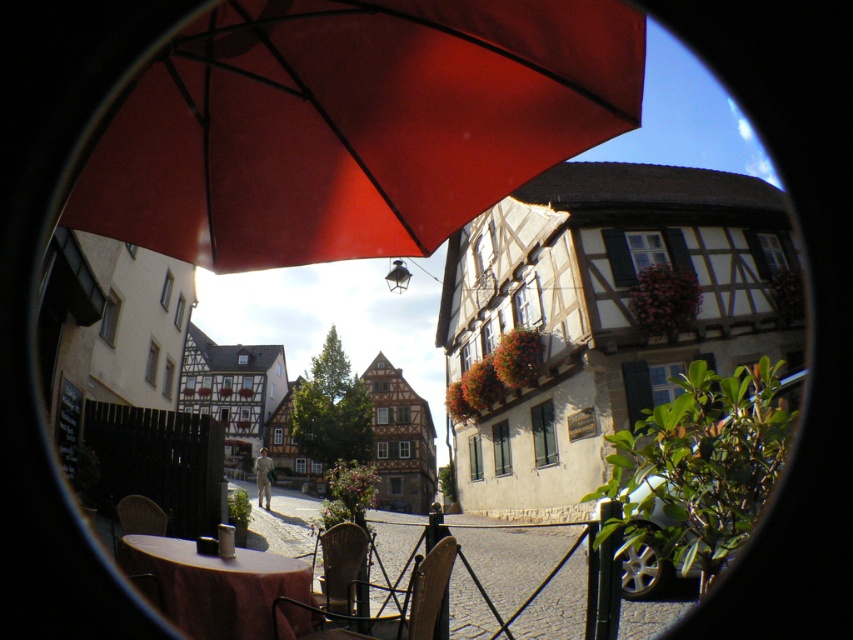
Question: In this image, where is smooth stone alley at center located relative to brown fabric table at lower left?

Choices:
 (A) below
 (B) above

Answer: (A)

Question: Which point is farther to the camera?

Choices:
 (A) (456, 548)
 (B) (544, 19)
 (C) (556, 620)
 (D) (335, 582)

Answer: (C)

Question: Does wooden chair at lower center have a lesser width compared to metallic brown chair at center?

Choices:
 (A) yes
 (B) no

Answer: (B)

Question: Which of the following is the farthest from the observer?

Choices:
 (A) metallic brown chair at center
 (B) smooth stone alley at center
 (C) wooden chair at lower center

Answer: (B)

Question: Can you confirm if smooth stone alley at center is positioned to the right of wooden chair at lower center?

Choices:
 (A) no
 (B) yes

Answer: (A)

Question: Considering the real-world distances, which object is closest to the matte red umbrella at upper center?

Choices:
 (A) wooden chair at lower center
 (B) brown fabric table at lower left
 (C) metallic brown chair at center

Answer: (A)